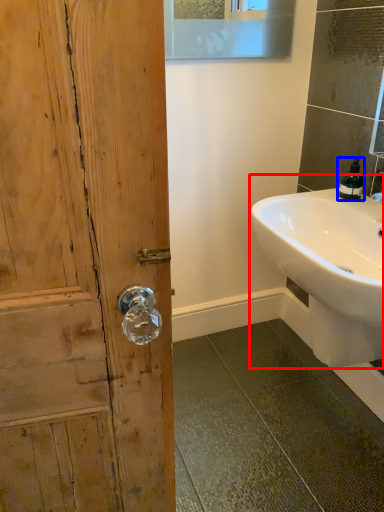
Question: Among these objects, which one is farthest to the camera, sink (highlighted by a red box) or soap dispenser (highlighted by a blue box)?

Choices:
 (A) sink
 (B) soap dispenser

Answer: (B)